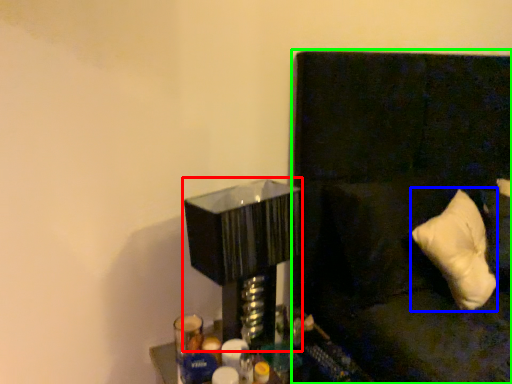
Question: Which object is the farthest from table lamp (highlighted by a red box)? Choose among these: pillow (highlighted by a blue box) or couch (highlighted by a green box).

Choices:
 (A) pillow
 (B) couch

Answer: (A)